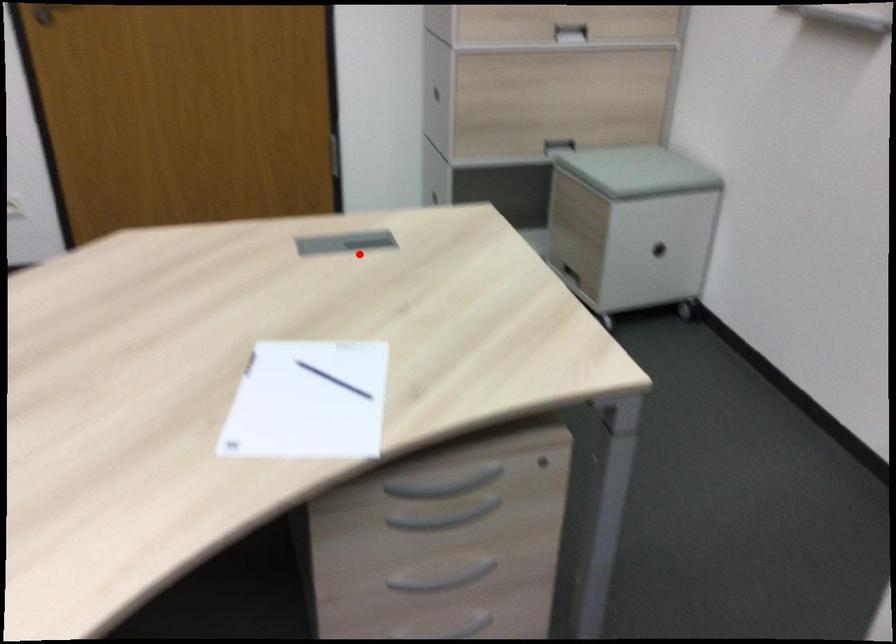
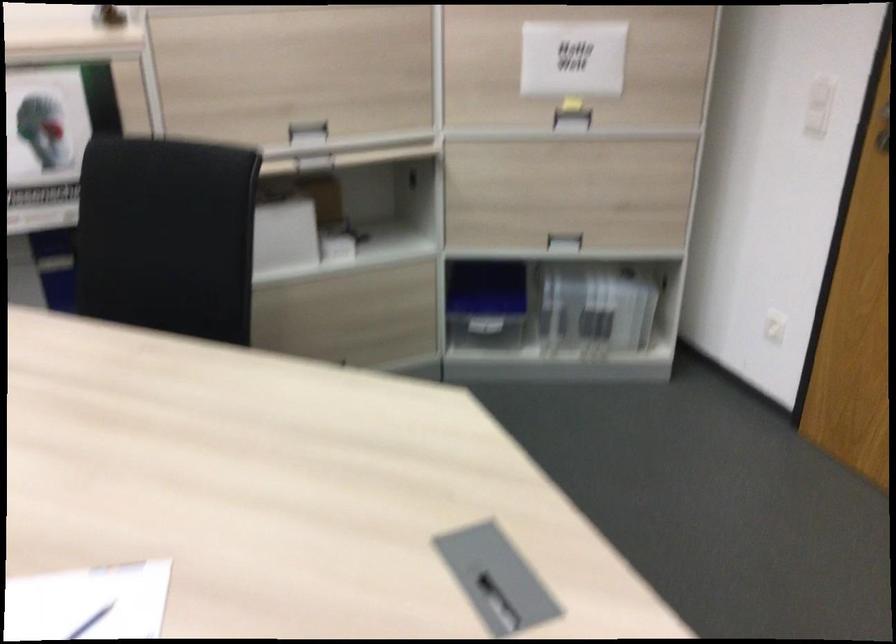
Question: A red point is marked in image1. In image2, is the corresponding 3D point closer to the camera or farther? Reply with the corresponding letter.

Choices:
 (A) The corresponding 3D point is closer.
 (B) The corresponding 3D point is farther.

Answer: (A)